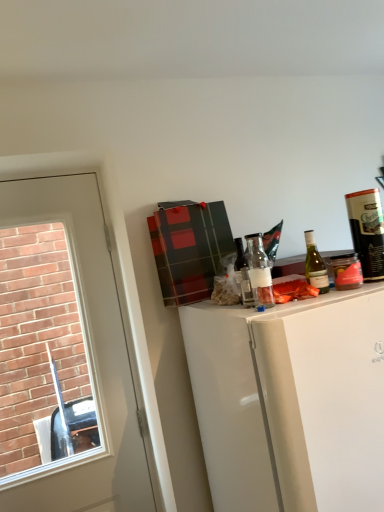
The height and width of the screenshot is (512, 384). In order to click on free space above white glossy door at left (from a real-world perspective) in this screenshot , I will do `click(43, 176)`.